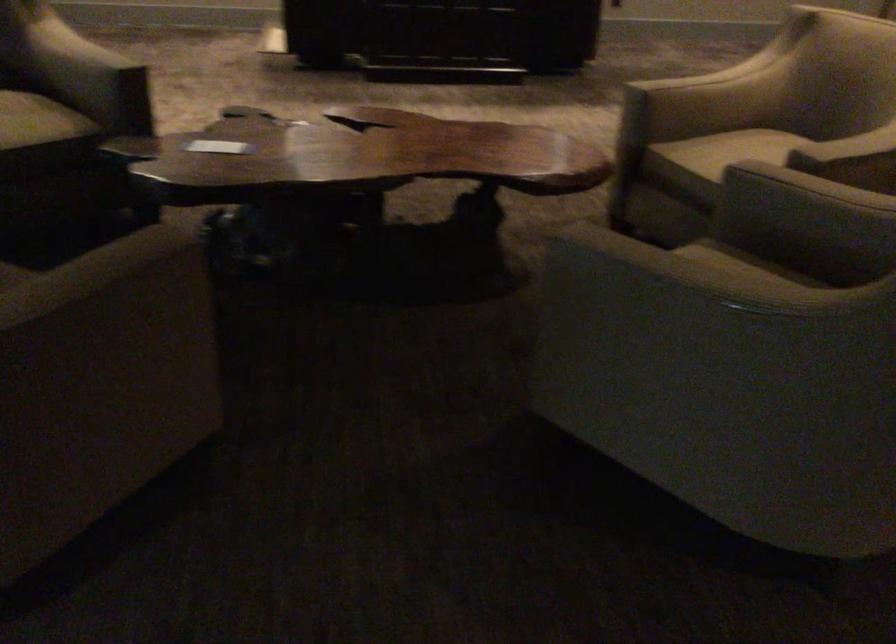
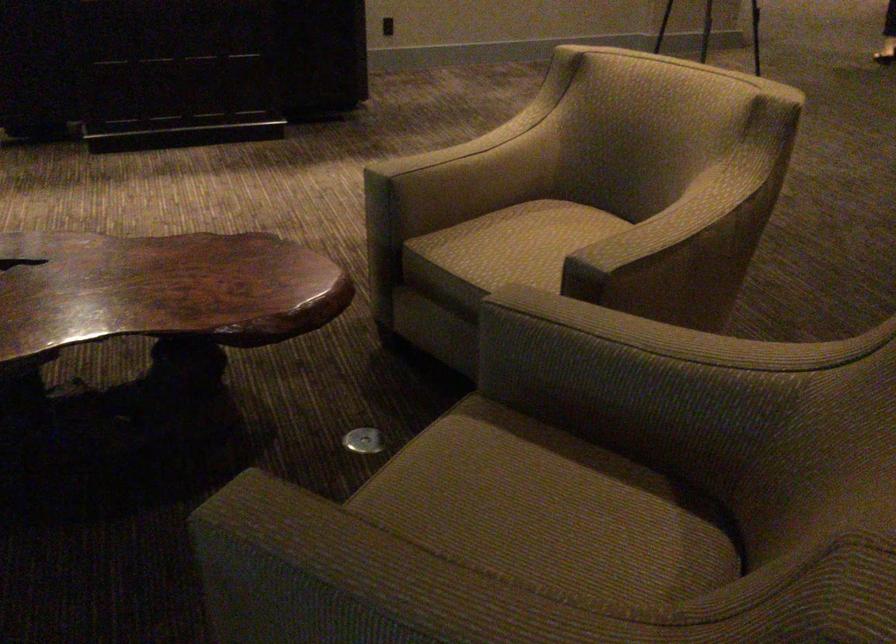
The point at (760, 156) is marked in the first image. Where is the corresponding point in the second image?

(535, 242)